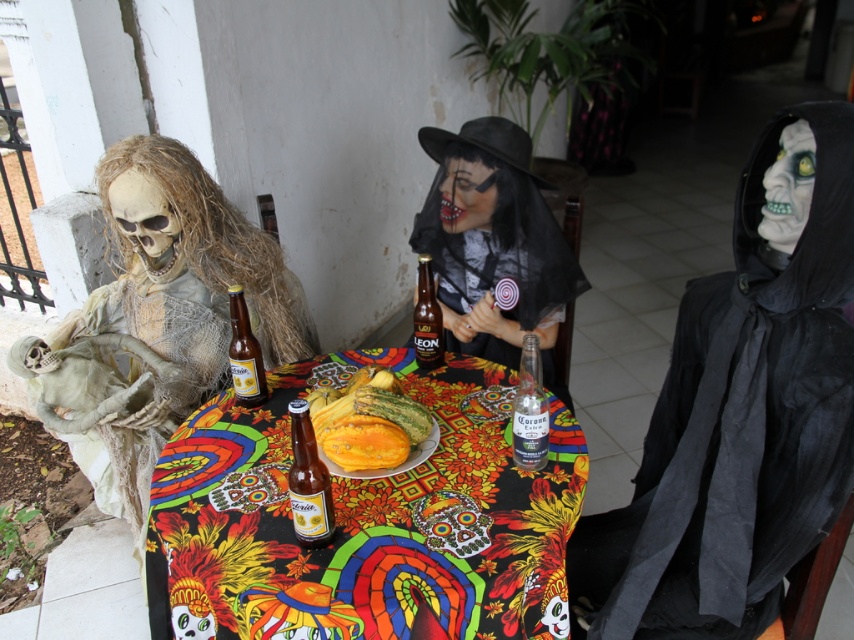
Question: Is matte black dress at center positioned behind translucent glass beer bottle at center?

Choices:
 (A) no
 (B) yes

Answer: (B)

Question: Where is black matte hood at right located in relation to translucent glass beer bottle at center in the image?

Choices:
 (A) above
 (B) below

Answer: (A)

Question: Can you confirm if matte black dress at center is positioned above translucent glass beer bottle at center?

Choices:
 (A) no
 (B) yes

Answer: (B)

Question: Estimate the real-world distances between objects in this image. Which object is farther from the translucent glass beer bottle at center?

Choices:
 (A) matte black dress at center
 (B) translucent glass bottle at center

Answer: (A)

Question: Among these objects, which one is farthest from the camera?

Choices:
 (A) black matte hood at right
 (B) brown glass beer bottle at center
 (C) matte white skeleton at left

Answer: (C)

Question: Which object is the closest to the black matte hood at right?

Choices:
 (A) matte white skeleton at left
 (B) translucent glass beer bottle at center
 (C) brown glass bottle at center

Answer: (C)